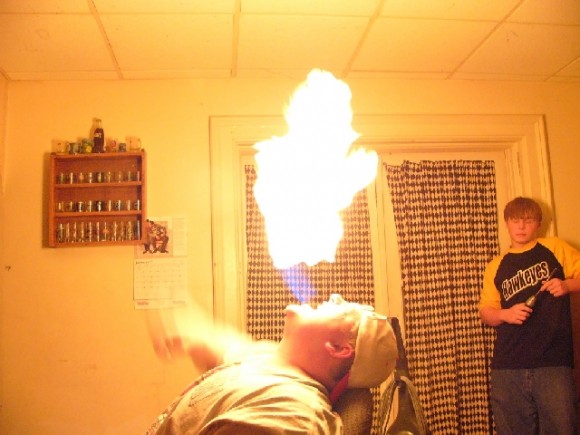
Identify the location of ceiling tile. This screenshot has height=435, width=580. (295, 41), (217, 53), (79, 34), (423, 35), (514, 51), (550, 10), (478, 8).